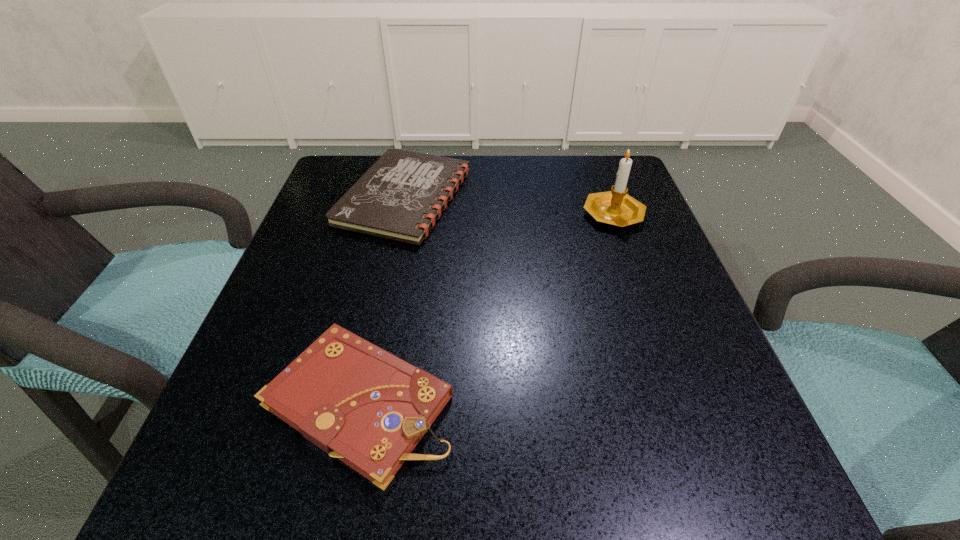
Locate an element on the screen. The width and height of the screenshot is (960, 540). the closest object to the farther notebook is located at coordinates (357, 402).

In order to click on the closest object relative to the farther notebook in this screenshot , I will do `click(357, 402)`.

Where is `vacant area in the image that satisfies the following two spatial constraints: 1. on the front side of the tallest object; 2. on the left side of the farther notebook`? This screenshot has height=540, width=960. vacant area in the image that satisfies the following two spatial constraints: 1. on the front side of the tallest object; 2. on the left side of the farther notebook is located at coordinates (401, 212).

The height and width of the screenshot is (540, 960). I want to click on blank area in the image that satisfies the following two spatial constraints: 1. on the front side of the shortest object; 2. on the right side of the candle holder, so click(x=401, y=212).